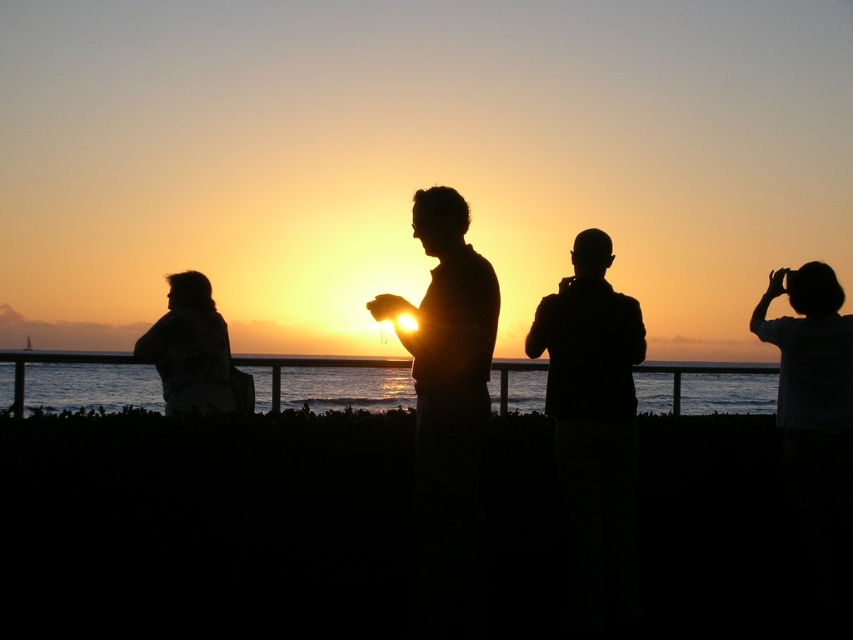
You are a photographer trying to capture the sunset scene. You notice the white matte shirt at right and the silhouette jacket at left in your frame. Which object should you adjust your focus on if you want both to be in clear view without overlapping?

The silhouette jacket at left is behind the white matte shirt at right. To ensure both are in clear view without overlapping, adjust your focus on the silhouette jacket at left first, then recompose to include the white matte shirt at right, ensuring they are aligned within the focal range.